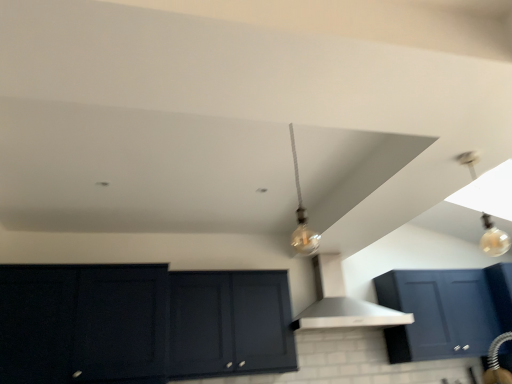
This screenshot has height=384, width=512. Describe the element at coordinates (342, 302) in the screenshot. I see `white matte vent at center` at that location.

Locate an element on the screen. matte dark blue cabinet at lower left, which is counted as the first cabinetry, starting from the left is located at coordinates (141, 323).

Find the location of a particular element. translucent glass bulb at upper right is located at coordinates (486, 204).

This screenshot has height=384, width=512. I want to click on white matte vent at center, so click(x=342, y=302).

Is translucent glass bulb at upper right facing away from matte black cabinet at center, which is the 2th cabinetry in left-to-right order?

That's not correct — translucent glass bulb at upper right is not looking away from matte black cabinet at center, which is the 2th cabinetry in left-to-right order.

Based on the photo, from the image's perspective, would you say translucent glass bulb at upper right is shown under matte black cabinet at center, which is the 2th cabinetry in left-to-right order?

No, from the image's perspective, translucent glass bulb at upper right is not beneath matte black cabinet at center, which is the 2th cabinetry in left-to-right order.

Is translucent glass bulb at upper right at the right side of matte black cabinet at center, the 1th cabinetry when ordered from right to left?

Correct, you'll find translucent glass bulb at upper right to the right of matte black cabinet at center, the 1th cabinetry when ordered from right to left.

Does point (487, 252) lie behind point (280, 283)?

Yes.

Consider the image. From a real-world perspective, which is physically above, matte dark blue cabinet at lower left, placed as the 2th cabinetry when sorted from right to left, or translucent glass bulb at upper right?

From a 3D spatial view, translucent glass bulb at upper right is above.

Can you confirm if matte dark blue cabinet at lower left, which is counted as the first cabinetry, starting from the left, is positioned to the right of translucent glass bulb at upper right?

In fact, matte dark blue cabinet at lower left, which is counted as the first cabinetry, starting from the left, is to the left of translucent glass bulb at upper right.

Which is in front, point (103, 382) or point (475, 180)?

Point (103, 382)

Are matte dark blue cabinet at lower left, placed as the 2th cabinetry when sorted from right to left, and translucent glass bulb at upper right making contact?

They are not placed beside each other.

Is white matte vent at center facing towards matte black cabinet at center, the 1th cabinetry when ordered from right to left?

No, white matte vent at center does not turn towards matte black cabinet at center, the 1th cabinetry when ordered from right to left.

From the image's perspective, is white matte vent at center below matte black cabinet at center, which is the 2th cabinetry in left-to-right order?

Actually, white matte vent at center appears above matte black cabinet at center, which is the 2th cabinetry in left-to-right order, in the image.

In terms of height, does white matte vent at center look taller or shorter compared to matte black cabinet at center, which is the 2th cabinetry in left-to-right order?

Considering their sizes, white matte vent at center has less height than matte black cabinet at center, which is the 2th cabinetry in left-to-right order.

Who is more distant, white matte vent at center or matte black cabinet at center, which is the 2th cabinetry in left-to-right order?

white matte vent at center is behind.

Could white matte vent at center be considered to be inside translucent glass bulb at upper right?

Result: Actually, white matte vent at center is outside translucent glass bulb at upper right.

Is translucent glass bulb at upper right oriented away from white matte vent at center?

No, translucent glass bulb at upper right is not facing away from white matte vent at center.

Are translucent glass bulb at upper right and white matte vent at center far apart?

Yes, translucent glass bulb at upper right and white matte vent at center are located far from each other.

How many degrees apart are the facing directions of translucent glass bulb at upper right and white matte vent at center?

translucent glass bulb at upper right and white matte vent at center are facing 91.4 degrees away from each other.

Is matte black cabinet at center, which is the 2th cabinetry in left-to-right order, thinner than matte dark blue cabinet at lower left, placed as the 2th cabinetry when sorted from right to left?

Yes.

Is matte black cabinet at center, which is the 2th cabinetry in left-to-right order, taller than matte dark blue cabinet at lower left, placed as the 2th cabinetry when sorted from right to left?

No, matte black cabinet at center, which is the 2th cabinetry in left-to-right order, is not taller than matte dark blue cabinet at lower left, placed as the 2th cabinetry when sorted from right to left.

Is matte black cabinet at center, which is the 2th cabinetry in left-to-right order, outside of matte dark blue cabinet at lower left, which is counted as the first cabinetry, starting from the left?

Yes.

Who is bigger, matte dark blue cabinet at lower left, which is counted as the first cabinetry, starting from the left, or matte black cabinet at center, which is the 2th cabinetry in left-to-right order?

matte dark blue cabinet at lower left, which is counted as the first cabinetry, starting from the left, is bigger.

Which is behind, point (292, 342) or point (274, 352)?

The point (292, 342) is farther from the camera.

In terms of height, does matte dark blue cabinet at lower left, which is counted as the first cabinetry, starting from the left, look taller or shorter compared to matte black cabinet at center, the 1th cabinetry when ordered from right to left?

Clearly, matte dark blue cabinet at lower left, which is counted as the first cabinetry, starting from the left, is taller compared to matte black cabinet at center, the 1th cabinetry when ordered from right to left.

Would you say matte dark blue cabinet at lower left, which is counted as the first cabinetry, starting from the left, is inside or outside matte black cabinet at center, which is the 2th cabinetry in left-to-right order?

matte dark blue cabinet at lower left, which is counted as the first cabinetry, starting from the left, lies outside matte black cabinet at center, which is the 2th cabinetry in left-to-right order.

Is the surface of matte black cabinet at center, which is the 2th cabinetry in left-to-right order, in direct contact with translucent glass bulb at upper right?

No, matte black cabinet at center, which is the 2th cabinetry in left-to-right order, is not touching translucent glass bulb at upper right.

Considering the relative sizes of matte black cabinet at center, which is the 2th cabinetry in left-to-right order, and translucent glass bulb at upper right in the image provided, is matte black cabinet at center, which is the 2th cabinetry in left-to-right order, thinner than translucent glass bulb at upper right?

In fact, matte black cabinet at center, which is the 2th cabinetry in left-to-right order, might be wider than translucent glass bulb at upper right.

From a real-world perspective, is matte black cabinet at center, which is the 2th cabinetry in left-to-right order, above or below translucent glass bulb at upper right?

matte black cabinet at center, which is the 2th cabinetry in left-to-right order, is below translucent glass bulb at upper right.

Is matte black cabinet at center, which is the 2th cabinetry in left-to-right order, at the left side of translucent glass bulb at upper right?

Yes.

Where is `the 2nd cabinetry behind the translucent glass bulb at upper right`? Image resolution: width=512 pixels, height=384 pixels. the 2nd cabinetry behind the translucent glass bulb at upper right is located at coordinates (230, 324).

Find the location of a particular element. light fixture on the right of matte dark blue cabinet at lower left, placed as the 2th cabinetry when sorted from right to left is located at coordinates pyautogui.click(x=486, y=204).

Looking at the image, which one is located closer to white matte vent at center, matte black cabinet at center, which is the 2th cabinetry in left-to-right order, or matte dark blue cabinet at lower left, which is counted as the first cabinetry, starting from the left?

matte black cabinet at center, which is the 2th cabinetry in left-to-right order, is closer to white matte vent at center.

Based on their spatial positions, is matte dark blue cabinet at lower left, which is counted as the first cabinetry, starting from the left, or white matte vent at center closer to matte black cabinet at center, the 1th cabinetry when ordered from right to left?

Among the two, matte dark blue cabinet at lower left, which is counted as the first cabinetry, starting from the left, is located nearer to matte black cabinet at center, the 1th cabinetry when ordered from right to left.

Estimate the real-world distances between objects in this image. Which object is further from matte dark blue cabinet at lower left, which is counted as the first cabinetry, starting from the left, matte black cabinet at center, the 1th cabinetry when ordered from right to left, or white matte vent at center?

Among the two, white matte vent at center is located further to matte dark blue cabinet at lower left, which is counted as the first cabinetry, starting from the left.

Looking at this image, considering their positions, is white matte vent at center positioned closer to matte dark blue cabinet at lower left, placed as the 2th cabinetry when sorted from right to left, than matte black cabinet at center, the 1th cabinetry when ordered from right to left?

Based on the image, matte black cabinet at center, the 1th cabinetry when ordered from right to left, appears to be nearer to matte dark blue cabinet at lower left, placed as the 2th cabinetry when sorted from right to left.

When comparing their distances from matte dark blue cabinet at lower left, placed as the 2th cabinetry when sorted from right to left, does white matte vent at center or translucent glass bulb at upper right seem closer?

The object closer to matte dark blue cabinet at lower left, placed as the 2th cabinetry when sorted from right to left, is white matte vent at center.

Considering their positions, is matte dark blue cabinet at lower left, which is counted as the first cabinetry, starting from the left, positioned further to translucent glass bulb at upper right than matte black cabinet at center, the 1th cabinetry when ordered from right to left?

matte dark blue cabinet at lower left, which is counted as the first cabinetry, starting from the left, is positioned further to the anchor translucent glass bulb at upper right.

When comparing their distances from matte black cabinet at center, which is the 2th cabinetry in left-to-right order, does white matte vent at center or matte dark blue cabinet at lower left, which is counted as the first cabinetry, starting from the left, seem closer?

Based on the image, matte dark blue cabinet at lower left, which is counted as the first cabinetry, starting from the left, appears to be nearer to matte black cabinet at center, which is the 2th cabinetry in left-to-right order.

Considering their positions, is translucent glass bulb at upper right positioned further to matte black cabinet at center, the 1th cabinetry when ordered from right to left, than matte dark blue cabinet at lower left, which is counted as the first cabinetry, starting from the left?

translucent glass bulb at upper right is positioned further to the anchor matte black cabinet at center, the 1th cabinetry when ordered from right to left.

Identify the location of cabinetry between matte dark blue cabinet at lower left, which is counted as the first cabinetry, starting from the left, and white matte vent at center, in the horizontal direction. The width and height of the screenshot is (512, 384). (230, 324).

Locate an element on the screen. vent situated between matte dark blue cabinet at lower left, which is counted as the first cabinetry, starting from the left, and translucent glass bulb at upper right from left to right is located at coordinates (342, 302).

You are a GUI agent. You are given a task and a screenshot of the screen. Output one action in this format:
    pyautogui.click(x=<x>, y=<y>)
    Task: Click on the cabinetry between matte dark blue cabinet at lower left, which is counted as the first cabinetry, starting from the left, and translucent glass bulb at upper right
    
    Given the screenshot: What is the action you would take?
    pyautogui.click(x=230, y=324)

Where is `vent between matte black cabinet at center, the 1th cabinetry when ordered from right to left, and translucent glass bulb at upper right, in the horizontal direction`? vent between matte black cabinet at center, the 1th cabinetry when ordered from right to left, and translucent glass bulb at upper right, in the horizontal direction is located at coordinates (342, 302).